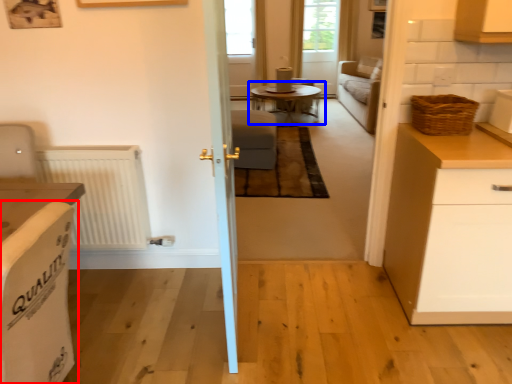
Question: Which object is closer to the camera taking this photo, armchair (highlighted by a red box) or table (highlighted by a blue box)?

Choices:
 (A) armchair
 (B) table

Answer: (A)